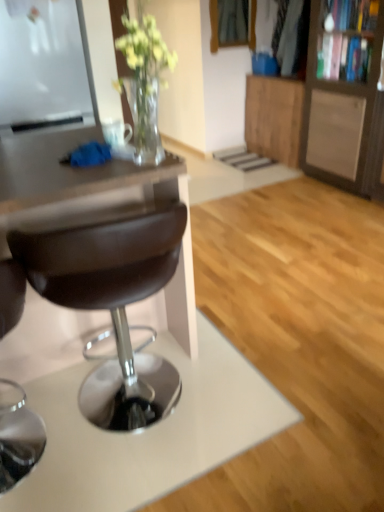
What are the coordinates of `vacant space underneath brown leather stool at center (from a real-world perspective)` in the screenshot? It's located at (161, 411).